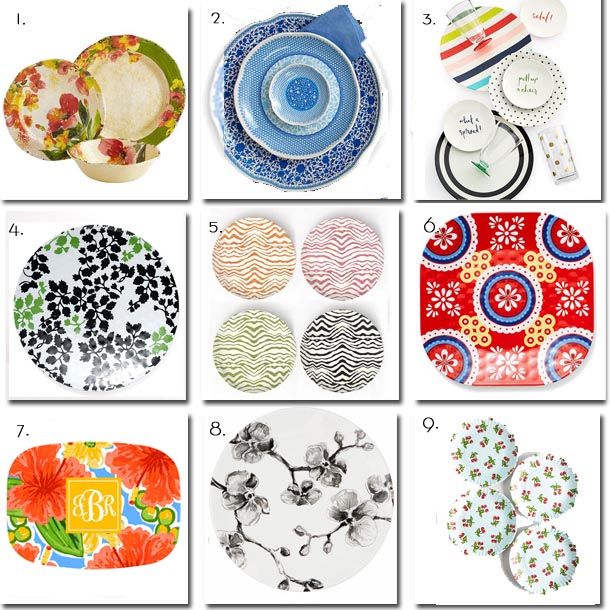
The height and width of the screenshot is (610, 610). I want to click on plate with multicolor stripes, so click(x=461, y=66).